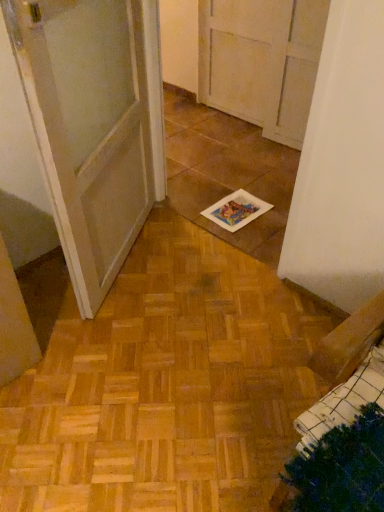
Image resolution: width=384 pixels, height=512 pixels. Find the location of `free space to the right of white glossy door at center`. free space to the right of white glossy door at center is located at coordinates (209, 275).